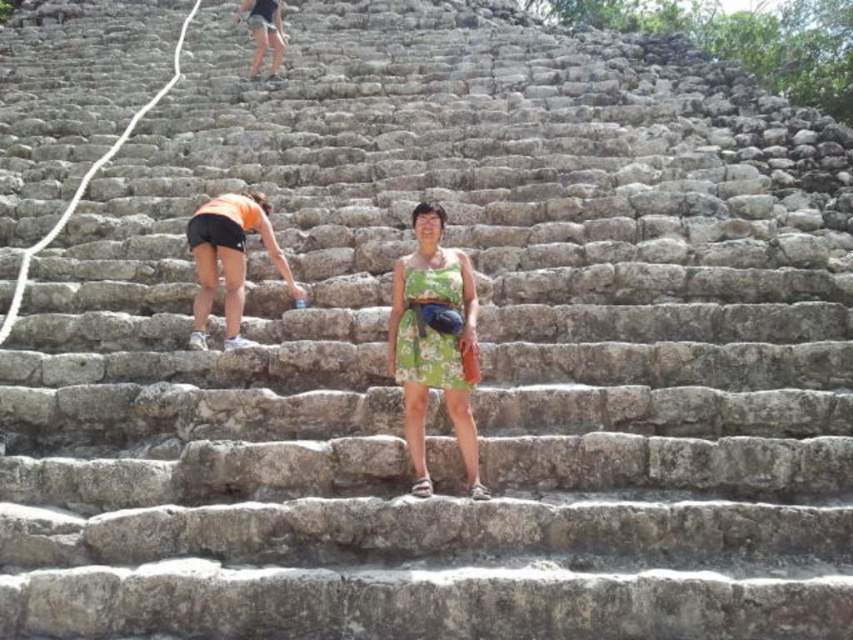
You are a fashion designer observing the ancient stone staircase scene. You notice the green floral dress at center and the orange fabric shorts at upper left. Which clothing item is narrower in width?

The green floral dress at center is narrower in width than the orange fabric shorts at upper left.

You are a tour guide leading a group at the ancient stone staircase. You need to inform visitors about the distance between the green floral dress at center and the orange fabric shorts at upper left. What do you tell them?

The green floral dress at center is 26.34 feet away from the orange fabric shorts at upper left.

You are standing at the bottom of the ancient stone staircase and want to take a photo of both the green floral dress at center and the orange fabric shorts at upper left. Which of the two objects is closer to your camera?

The green floral dress at center is closer to the viewer than the orange fabric shorts at upper left, so the green floral dress at center will appear larger in the photo.